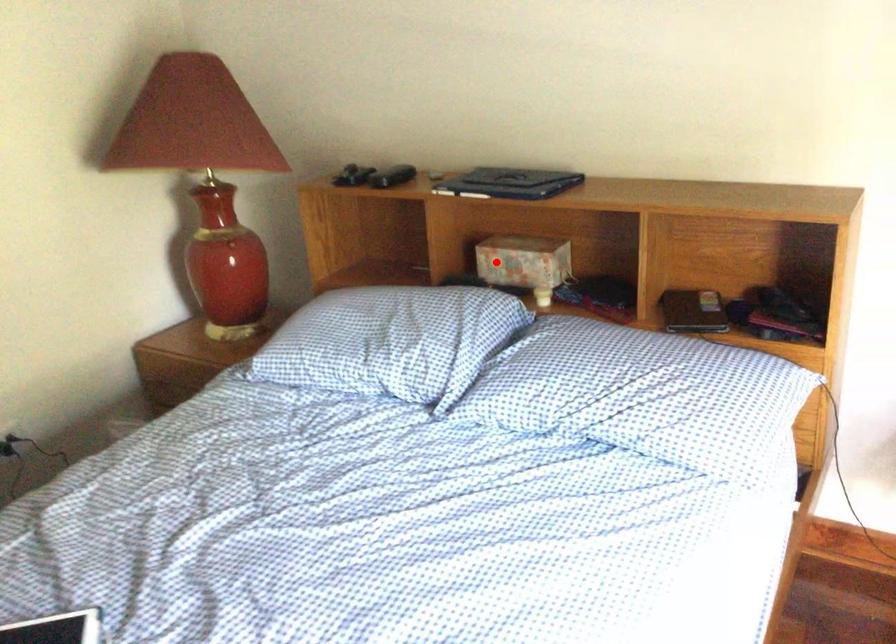
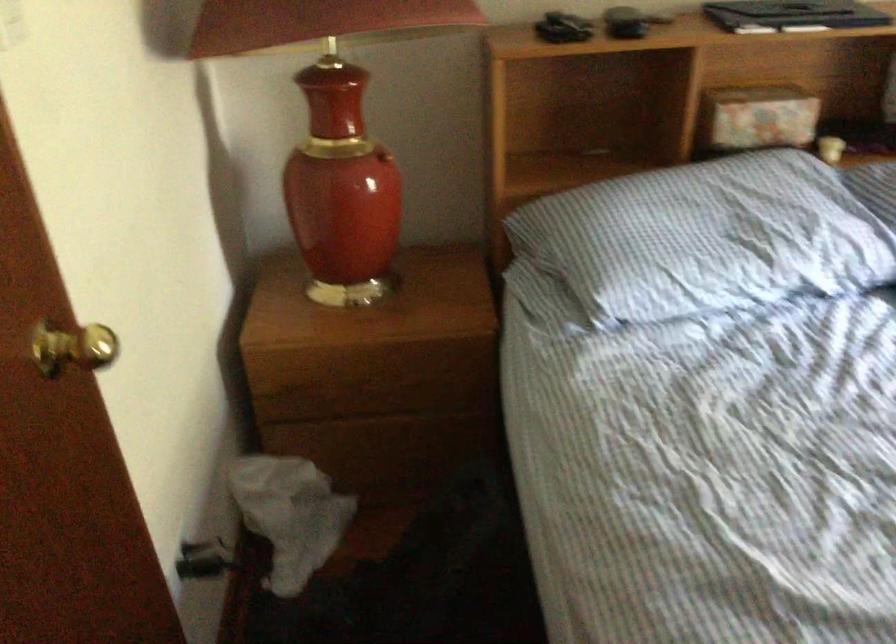
Question: I am providing you with two images of the same scene from different viewpoints. In image1, a red point is highlighted. Considering the same 3D point in image2, which of the following is correct?

Choices:
 (A) It is closer
 (B) It is farther

Answer: (A)